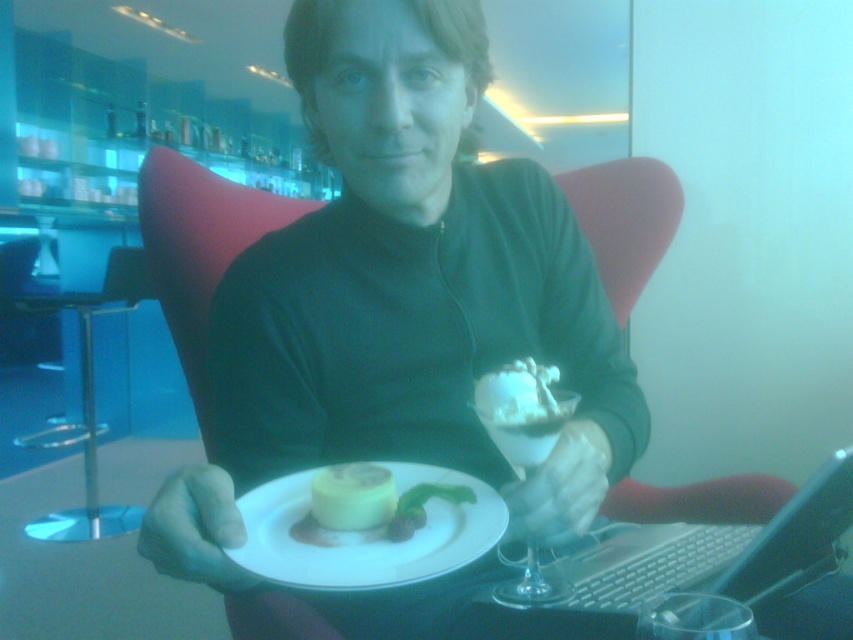
You are a photographer trying to capture a closeup shot of the dessert on the white ceramic plate at center. Your camera can focus on objects within 20 inches. Is the plate within the focus range?

The white ceramic plate at center is 20.71 inches away from the camera, which is slightly beyond the camera focus range of 20 inches. Therefore, the plate is not within the focus range.

You are a waiter in a restaurant and need to place a dessert order for a customer who wants both the white creamy cake at center and the clear glass dessert cup at center. According to the image, how are these two items arranged relative to each other?

The white creamy cake at center is positioned on the left side of the clear glass dessert cup at center.

You are a photographer setting up a shoot in this scene. You need to position a light source so that it illuminates both the matte green sweater at center and the white plastic laptop at lower right. Since the sweater is taller, where should you place the light to ensure both are well lit?

The matte green sweater at center is taller than the white plastic laptop at lower right. To ensure both are well lit, position the light source above and slightly behind the sweater so that its height doesn not block the light from reaching the laptop below.